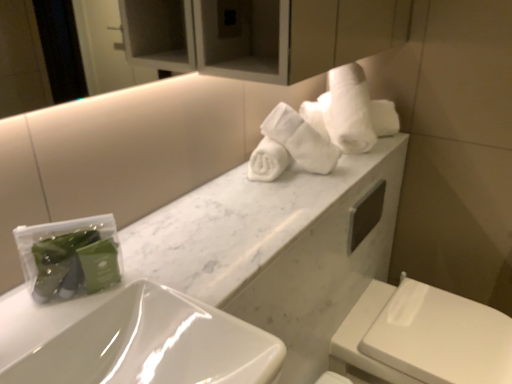
What is the approximate width of white glossy sink at lower left?

19.69 inches.

Locate an element on the screen. The height and width of the screenshot is (384, 512). white soft towel at upper right is located at coordinates (350, 112).

I want to click on white glossy sink at lower left, so click(x=141, y=344).

Is white glossy sink at lower left oriented away from white marble countertop at center?

No, white glossy sink at lower left is not facing away from white marble countertop at center.

Is white marble countertop at center completely or partially inside white glossy sink at lower left?

No, white marble countertop at center is not inside white glossy sink at lower left.

From the image's perspective, is white glossy sink at lower left located above or below white marble countertop at center?

white glossy sink at lower left is below white marble countertop at center.

You are a GUI agent. You are given a task and a screenshot of the screen. Output one action in this format:
    pyautogui.click(x=<x>, y=<y>)
    Task: Click on the toilet that is below the white glossy sink at lower left (from the image's perspective)
    
    Given the screenshot: What is the action you would take?
    pyautogui.click(x=425, y=336)

Does point (438, 356) lie behind point (106, 352)?

Yes, point (438, 356) is farther from viewer.

Would you say white glossy toilet at lower right contains white glossy sink at lower left?

No, white glossy sink at lower left is not surrounded by white glossy toilet at lower right.

Is white glossy toilet at lower right oriented towards white glossy sink at lower left?

No, white glossy toilet at lower right is not facing towards white glossy sink at lower left.

Between white soft towel at upper right and white marble countertop at center, which one has less height?

Standing shorter between the two is white marble countertop at center.

Is white soft towel at upper right placed right next to white marble countertop at center?

They are not placed beside each other.

Is white soft towel at upper right turned away from white marble countertop at center?

white soft towel at upper right is not turned away from white marble countertop at center.

Which is more to the left, white soft towel at upper right or white marble countertop at center?

white marble countertop at center.

Which of these two, white soft towel at upper right or white glossy toilet at lower right, is wider?

With larger width is white glossy toilet at lower right.

Based on the photo, between white soft towel at upper right and white glossy toilet at lower right, which one has smaller size?

white soft towel at upper right is smaller.

Is white soft towel at upper right not near white glossy toilet at lower right?

white soft towel at upper right is actually quite close to white glossy toilet at lower right.

At what (x,y) coordinates should I click in order to perform the action: click on porcelain below the white soft towel at upper right (from the image's perspective). Please return your answer as a coordinate pair (x, y). The width and height of the screenshot is (512, 384). Looking at the image, I should click on (277, 248).

Can you tell me how much white marble countertop at center and white soft towel at upper right differ in facing direction?

0.387 degrees.

Does white marble countertop at center have a lesser height compared to white soft towel at upper right?

Yes.

From a real-world perspective, which object rests below the other?

white marble countertop at center, from a real-world perspective.

From the image's perspective, who appears lower, white marble countertop at center or white glossy toilet at lower right?

white glossy toilet at lower right appears lower in the image.

Would you say white marble countertop at center is to the left or to the right of white glossy toilet at lower right in the picture?

Based on their positions, white marble countertop at center is located to the left of white glossy toilet at lower right.

Is point (230, 227) in front of point (398, 317)?

That is True.

Where is `porcelain on the left of white glossy toilet at lower right`? porcelain on the left of white glossy toilet at lower right is located at coordinates (277, 248).

Find the location of a particular element. bath towel above the white glossy toilet at lower right (from a real-world perspective) is located at coordinates (350, 112).

Would you say white glossy toilet at lower right is a long distance from white soft towel at upper right?

white glossy toilet at lower right is actually quite close to white soft towel at upper right.

Is white glossy toilet at lower right bigger than white soft towel at upper right?

Yes, white glossy toilet at lower right is bigger than white soft towel at upper right.

The width and height of the screenshot is (512, 384). What are the coordinates of `porcelain above the white glossy sink at lower left (from a real-world perspective)` in the screenshot? It's located at (277, 248).

Locate an element on the screen. The height and width of the screenshot is (384, 512). toilet beneath the white glossy sink at lower left (from a real-world perspective) is located at coordinates (425, 336).

Which object lies further to the anchor point white soft towel at upper right, white glossy sink at lower left or white glossy toilet at lower right?

Among the two, white glossy sink at lower left is located further to white soft towel at upper right.

Estimate the real-world distances between objects in this image. Which object is closer to white marble countertop at center, white glossy sink at lower left or white glossy toilet at lower right?

white glossy toilet at lower right lies closer to white marble countertop at center than the other object.

Based on their spatial positions, is white marble countertop at center or white glossy sink at lower left closer to white soft towel at upper right?

white marble countertop at center is closer to white soft towel at upper right.

Estimate the real-world distances between objects in this image. Which object is closer to white glossy toilet at lower right, white soft towel at upper right or white marble countertop at center?

white marble countertop at center.

Based on their spatial positions, is white marble countertop at center or white glossy sink at lower left further from white glossy toilet at lower right?

Among the two, white glossy sink at lower left is located further to white glossy toilet at lower right.

Which object lies nearer to the anchor point white glossy sink at lower left, white marble countertop at center or white glossy toilet at lower right?

Based on the image, white marble countertop at center appears to be nearer to white glossy sink at lower left.

From the image, which object appears to be farther from white glossy sink at lower left, white soft towel at upper right or white glossy toilet at lower right?

The object further to white glossy sink at lower left is white glossy toilet at lower right.

Estimate the real-world distances between objects in this image. Which object is further from white glossy toilet at lower right, white soft towel at upper right or white glossy sink at lower left?

white glossy sink at lower left is positioned further to the anchor white glossy toilet at lower right.

Find the location of a particular element. The height and width of the screenshot is (384, 512). sink between white soft towel at upper right and white glossy toilet at lower right in the vertical direction is located at coordinates (141, 344).

The image size is (512, 384). Identify the location of porcelain located between white glossy sink at lower left and white glossy toilet at lower right in the left-right direction. (277, 248).

Where is `porcelain between white soft towel at upper right and white glossy toilet at lower right from top to bottom`? The width and height of the screenshot is (512, 384). porcelain between white soft towel at upper right and white glossy toilet at lower right from top to bottom is located at coordinates (277, 248).

Image resolution: width=512 pixels, height=384 pixels. I want to click on porcelain between white glossy sink at lower left and white soft towel at upper right in the front-back direction, so click(x=277, y=248).